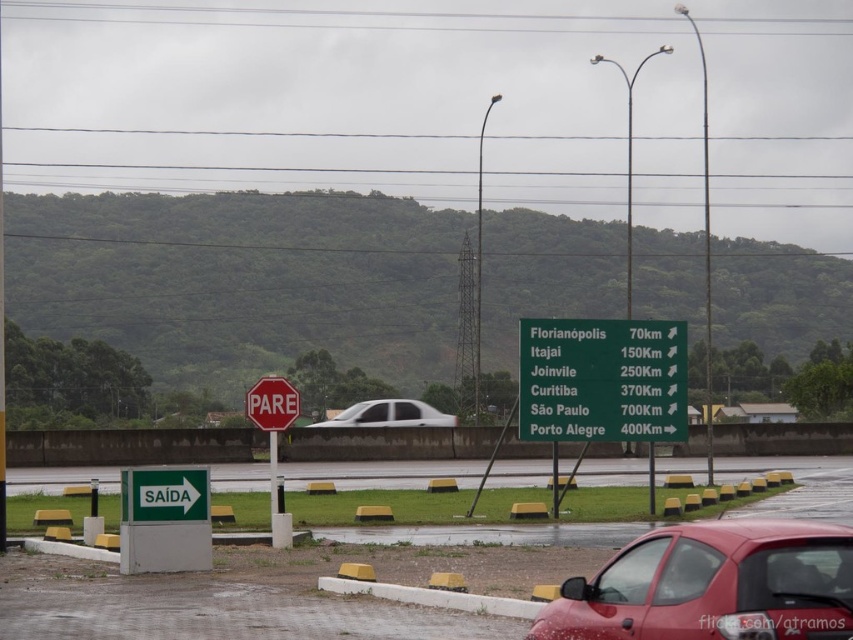
Question: Is shiny red car at lower right further to the viewer compared to red metal stop sign at center?

Choices:
 (A) no
 (B) yes

Answer: (A)

Question: Considering the real-world distances, which object is farthest from the shiny red car at lower right?

Choices:
 (A) green sign at lower center
 (B) green metallic sign at center

Answer: (A)

Question: Does green sign at lower center have a lesser width compared to white matte sedan at center?

Choices:
 (A) yes
 (B) no

Answer: (B)

Question: Among these points, which one is nearest to the camera?

Choices:
 (A) (393, 481)
 (B) (408, 422)
 (C) (821, 596)
 (D) (281, 413)

Answer: (C)

Question: Can you confirm if shiny red car at lower right is positioned below white matte sedan at center?

Choices:
 (A) yes
 (B) no

Answer: (B)

Question: Among these points, which one is farthest from the camera?

Choices:
 (A) (408, 397)
 (B) (653, 346)
 (C) (259, 416)

Answer: (A)